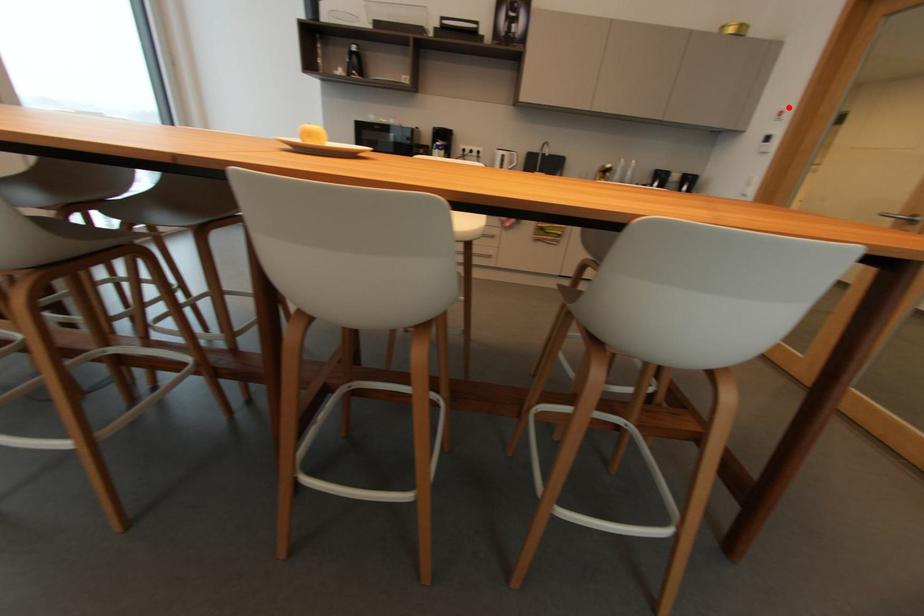
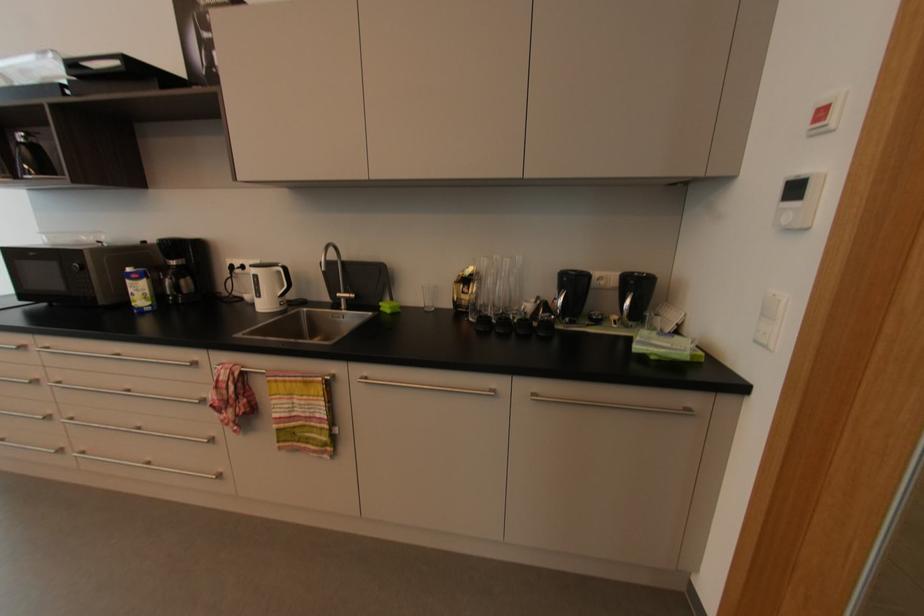
In the second image, find the point that corresponds to the highlighted location in the first image.

(832, 99)